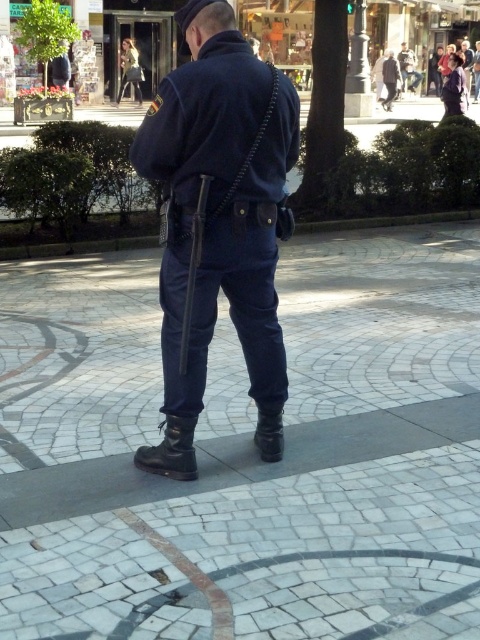
Which is above, navy blue fabric uniform at center or dark blue fabric uniform at center?

dark blue fabric uniform at center

Does navy blue fabric uniform at center have a lesser width compared to dark blue fabric uniform at center?

In fact, navy blue fabric uniform at center might be wider than dark blue fabric uniform at center.

Is point (262, 67) closer to viewer compared to point (389, 65)?

Yes, point (262, 67) is in front of point (389, 65).

What are the coordinates of `navy blue fabric uniform at center` in the screenshot? It's located at (220, 211).

Who is lower down, white stone pavement at center or polished metal pole at upper center?

white stone pavement at center

Does white stone pavement at center appear under polished metal pole at upper center?

Indeed, white stone pavement at center is positioned under polished metal pole at upper center.

Which is behind, point (256, 625) or point (364, 29)?

Positioned behind is point (364, 29).

This screenshot has height=640, width=480. I want to click on white stone pavement at center, so click(x=247, y=452).

Which is more to the right, dark blue fabric uniform at center or light brown leather jacket at upper center?

From the viewer's perspective, light brown leather jacket at upper center appears more on the right side.

Does dark blue fabric uniform at center have a lesser height compared to light brown leather jacket at upper center?

No, dark blue fabric uniform at center is not shorter than light brown leather jacket at upper center.

Image resolution: width=480 pixels, height=640 pixels. Describe the element at coordinates (389, 80) in the screenshot. I see `dark blue fabric uniform at center` at that location.

Locate an element on the screen. dark blue fabric uniform at center is located at coordinates (389, 80).